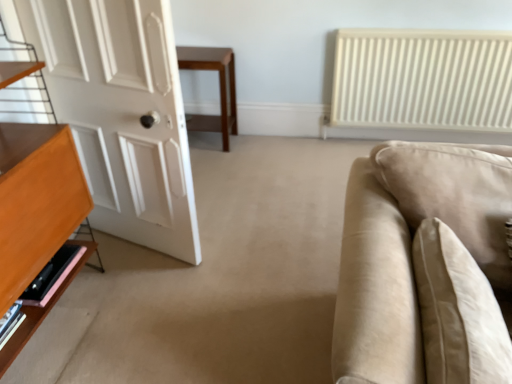
Question: From the image's perspective, would you say beige fabric pillow at right is shown under white matte door at left?

Choices:
 (A) no
 (B) yes

Answer: (B)

Question: Can you confirm if beige fabric pillow at right is wider than white matte door at left?

Choices:
 (A) yes
 (B) no

Answer: (A)

Question: Can you confirm if beige fabric pillow at right is smaller than white matte door at left?

Choices:
 (A) yes
 (B) no

Answer: (A)

Question: Does beige fabric pillow at right appear on the right side of white matte door at left?

Choices:
 (A) yes
 (B) no

Answer: (A)

Question: Could you tell me if beige fabric pillow at right is turned towards white matte door at left?

Choices:
 (A) no
 (B) yes

Answer: (A)

Question: Can you confirm if beige fabric pillow at right is shorter than white matte door at left?

Choices:
 (A) no
 (B) yes

Answer: (B)

Question: Is wooden table at center facing away from beige fabric couch at right?

Choices:
 (A) no
 (B) yes

Answer: (A)

Question: Does wooden table at center lie in front of beige fabric couch at right?

Choices:
 (A) yes
 (B) no

Answer: (B)

Question: Could you tell me if wooden table at center is turned towards beige fabric couch at right?

Choices:
 (A) no
 (B) yes

Answer: (A)

Question: From a real-world perspective, is wooden table at center over beige fabric couch at right?

Choices:
 (A) yes
 (B) no

Answer: (B)

Question: Is wooden table at center at the left side of beige fabric couch at right?

Choices:
 (A) no
 (B) yes

Answer: (B)

Question: Can you confirm if wooden table at center is wider than beige fabric couch at right?

Choices:
 (A) no
 (B) yes

Answer: (A)

Question: Is pink wood shelf at lower left wider than wooden table at center?

Choices:
 (A) no
 (B) yes

Answer: (A)